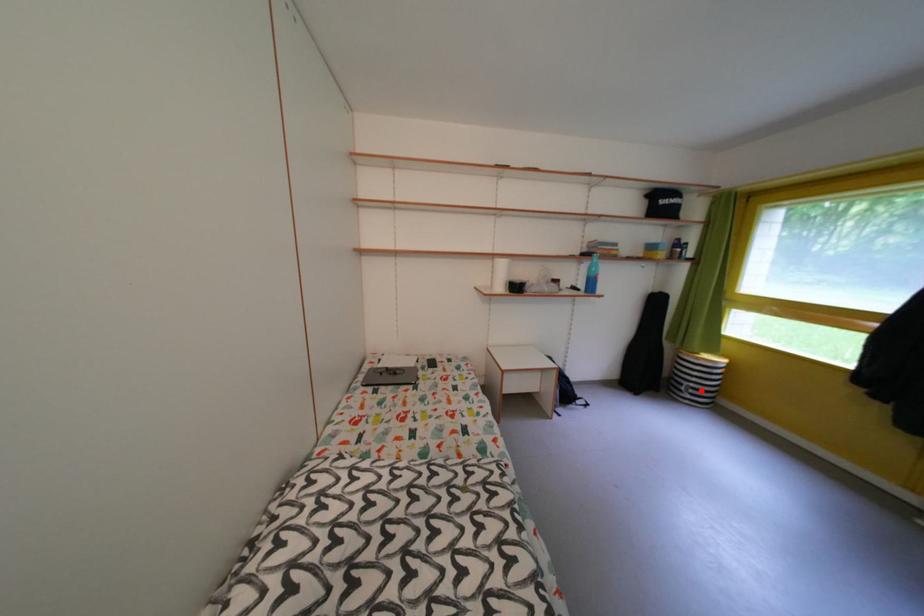
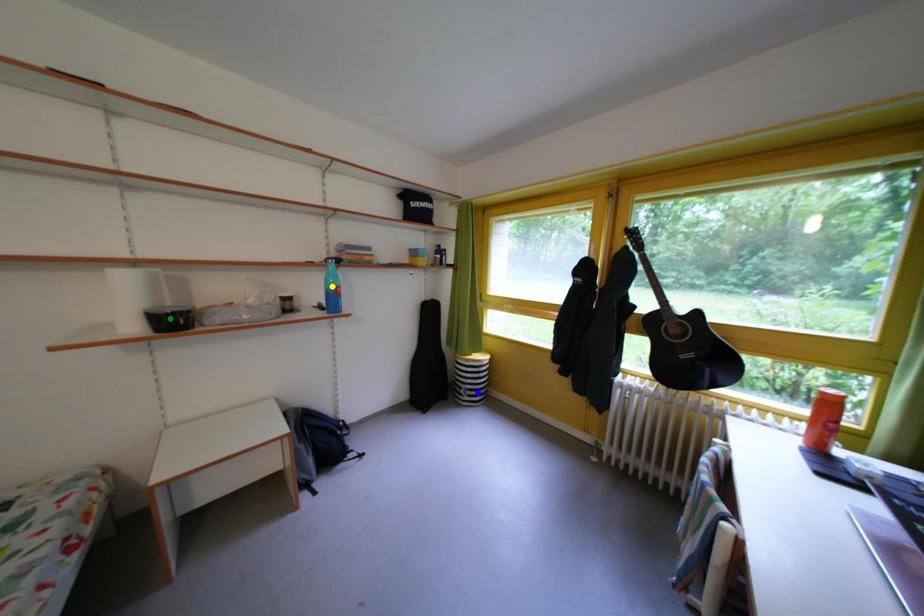
Question: I am providing you with two images of the same scene from different viewpoints. A red point is marked on the first image. You are given multiple points on the second image. Which mark in image 2 goes with the point in image 1?

Choices:
 (A) green point
 (B) yellow point
 (C) blue point

Answer: (C)